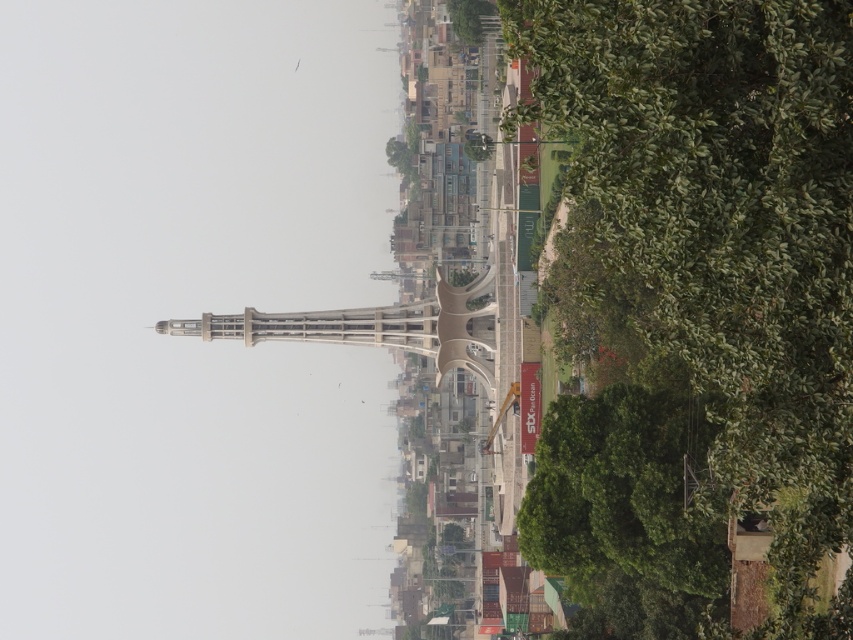
You are a city planner reviewing the cityscape image. You notice two green leafy trees in the scene. Which of the two trees, the green leafy tree at center or the green leafy tree at upper center, would cast a bigger shadow during midday?

The green leafy tree at center is larger in size than the green leafy tree at upper center, so it would cast a bigger shadow during midday.